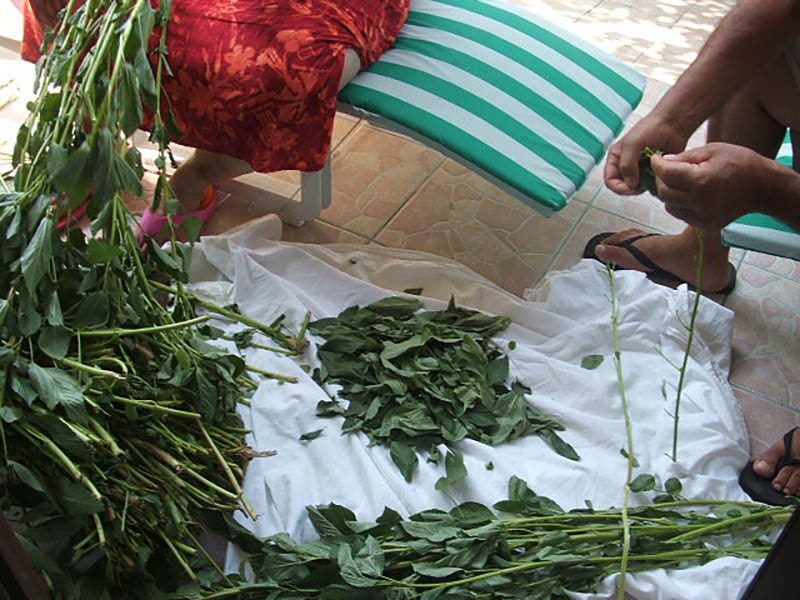
This screenshot has height=600, width=800. Find the location of `tile flooring`. tile flooring is located at coordinates (496, 236), (781, 346), (380, 196), (769, 423), (658, 208), (638, 24), (789, 272), (332, 240), (677, 52), (701, 20).